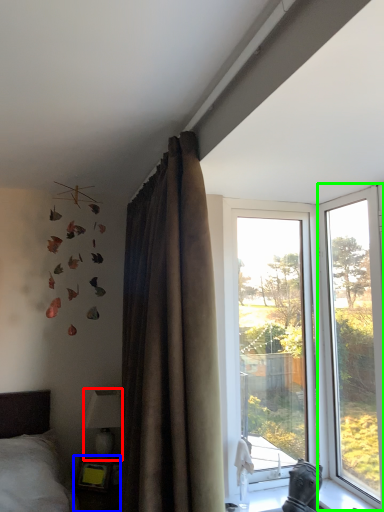
Question: Which is farther away from lamp (highlighted by a red box)? table (highlighted by a blue box) or window (highlighted by a green box)?

Choices:
 (A) table
 (B) window

Answer: (B)